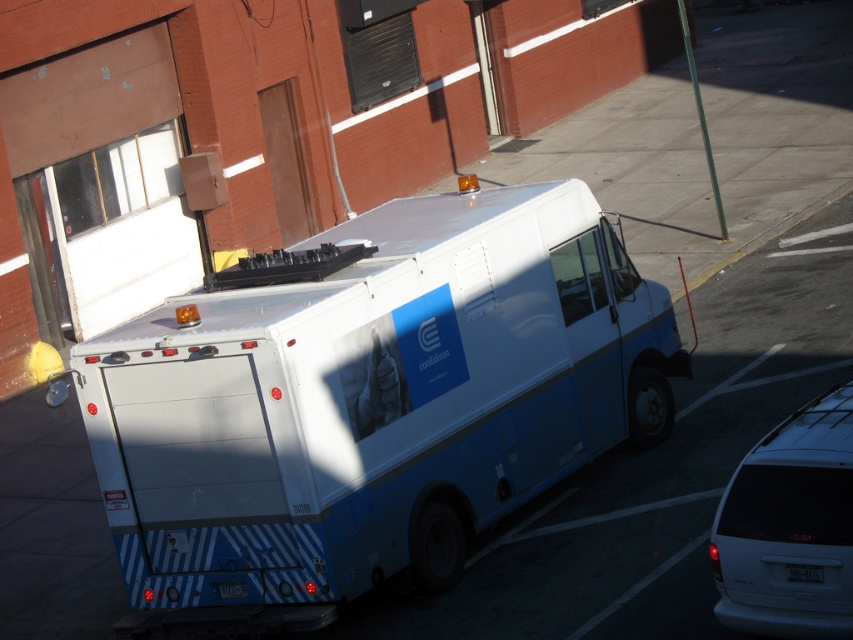
You are a delivery driver who needs to check both license plates on the utility truck. Which license plate is wider? Please compare the black plastic license plate at center and the white plastic license plate at rear.

The white plastic license plate at rear is wider than the black plastic license plate at center.

You are a delivery driver who needs to park your truck in the same parking spot as the Con Edison service truck. The parking spot has a maximum width limit of 2 meters. You know the white plastic license plate at rear is 0.3 meters wide. Can you determine if the white matte van at lower right will fit within the parking spot?

The white matte van at lower right is wider than the white plastic license plate at rear, which is 0.3 meters wide. Since the parking spot has a maximum width limit of 2 meters, the van should fit as its width is likely under 2 meters unless the van is excessively wide compared to the license plate. However, without exact measurements, it is uncertain. But based on the given information, the van is wider than 0.3 meters but not necessarily exceeding 2 meters.

You are a delivery driver who needs to verify the license plate number of the Con Edison service truck. The license plate is located at the center of the truck. Where exactly should you look on the truck to find the black plastic license plate at center?

The black plastic license plate at center is located at point (804, 572) on the truck.